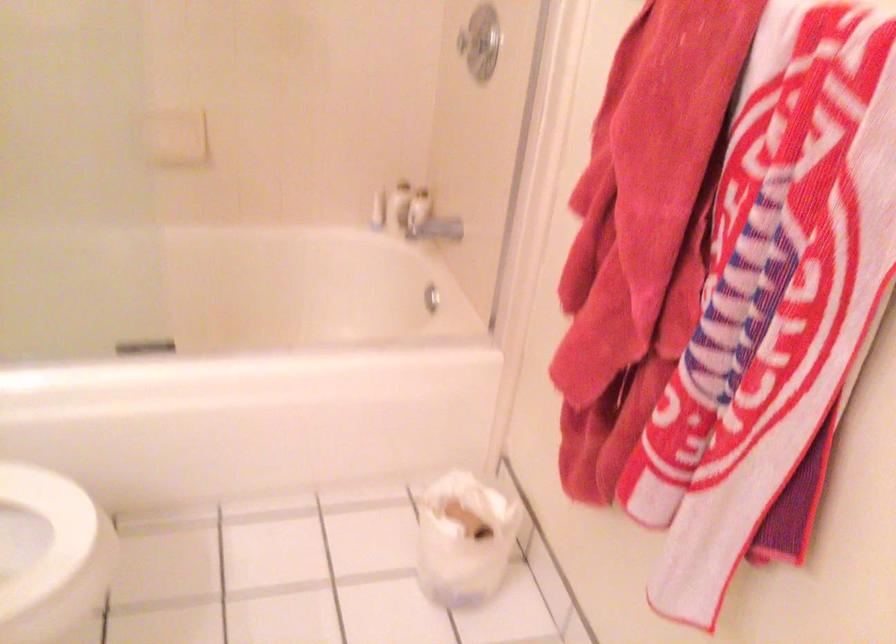
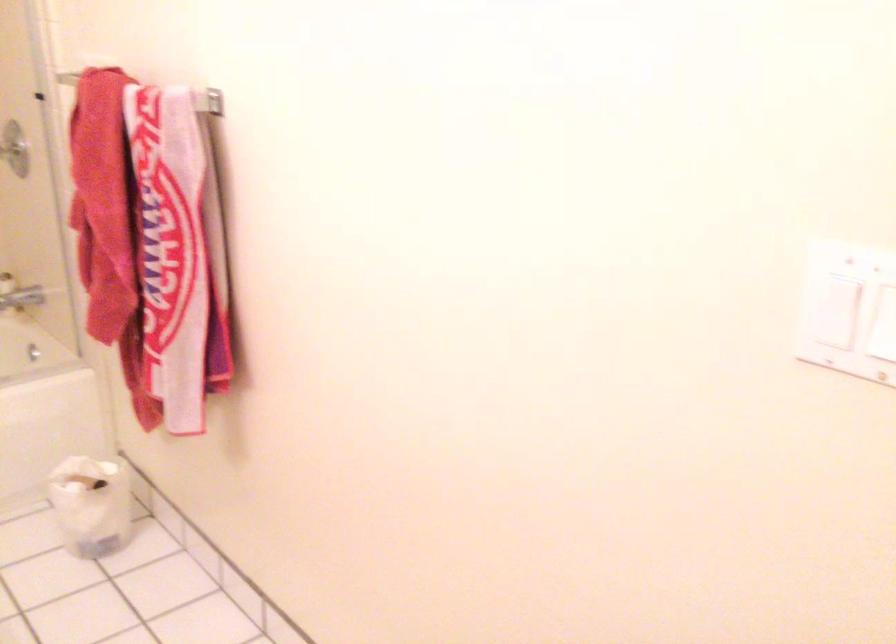
Where in the second image is the point corresponding to (432,232) from the first image?

(20, 299)